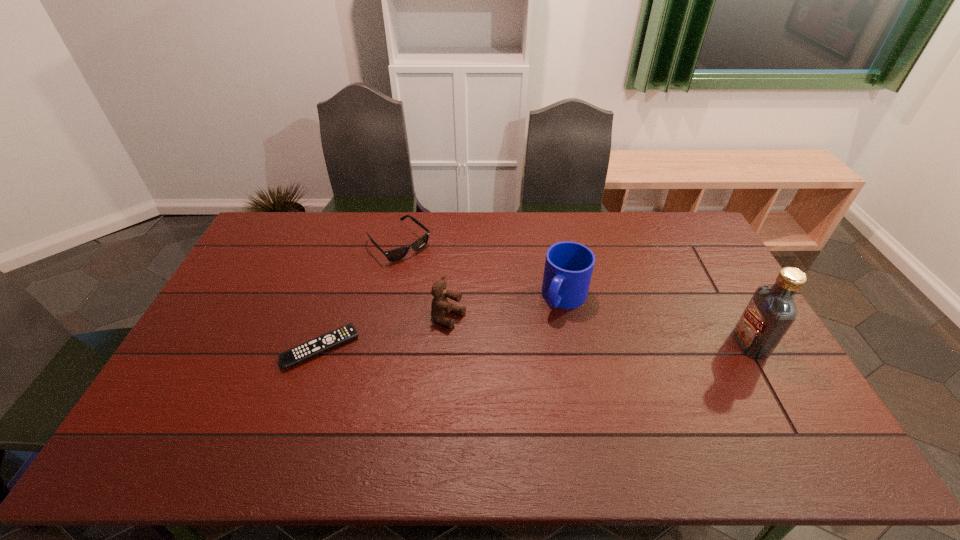
Locate an element on the screen. This screenshot has height=540, width=960. free space on the desktop that is between the remote control and the rightmost object and is positioned on the face of the teddy bear is located at coordinates (509, 346).

Find the location of a particular element. The width and height of the screenshot is (960, 540). free space on the desktop that is between the shortest object and the vodka and is positioned on the side with the handle of the mug is located at coordinates (536, 346).

You are a GUI agent. You are given a task and a screenshot of the screen. Output one action in this format:
    pyautogui.click(x=<x>, y=<y>)
    Task: Click on the free space on the desktop that is between the shortest object and the tallest object and is positioned on the front-facing side of the sunglasses
    Image resolution: width=960 pixels, height=540 pixels.
    Given the screenshot: What is the action you would take?
    pyautogui.click(x=510, y=346)